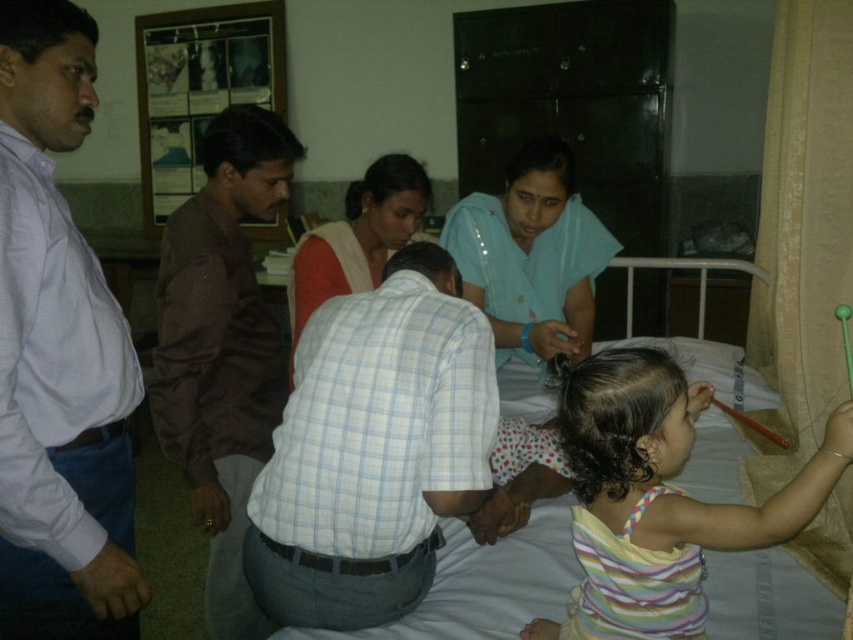
Does striped cotton shirt at lower right lie in front of light blue fabric at center?

Yes, striped cotton shirt at lower right is in front of light blue fabric at center.

Between point (650, 634) and point (572, 163), which one is positioned in front?

Positioned in front is point (650, 634).

Who is more forward, (x=717, y=529) or (x=573, y=323)?

Point (x=717, y=529)

At what (x,y) coordinates should I click in order to perform the action: click on striped cotton shirt at lower right. Please return your answer as a coordinate pair (x, y). The width and height of the screenshot is (853, 640). Looking at the image, I should click on (663, 490).

The image size is (853, 640). Describe the element at coordinates (56, 352) in the screenshot. I see `white shirt at left` at that location.

Does white shirt at left lie behind matte white shirt at center?

No, it is not.

Locate an element on the screen. The height and width of the screenshot is (640, 853). white shirt at left is located at coordinates (56, 352).

Is white checkered shirt at center to the left of matte white shirt at center from the viewer's perspective?

Incorrect, white checkered shirt at center is not on the left side of matte white shirt at center.

Is point (426, 520) farther from camera compared to point (405, 230)?

No, it is in front of (405, 230).

You are a GUI agent. You are given a task and a screenshot of the screen. Output one action in this format:
    pyautogui.click(x=<x>, y=<y>)
    Task: Click on the white checkered shirt at center
    This screenshot has height=640, width=853.
    Given the screenshot: What is the action you would take?
    pyautogui.click(x=373, y=449)